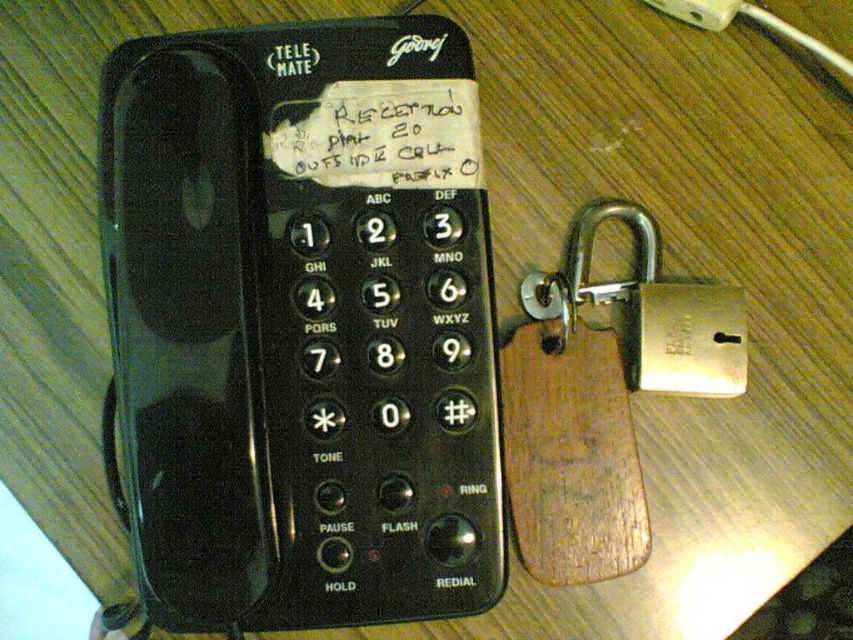
You are organizing items on a desk and need to place the white paper at center and the white plastic plug at upper right. According to the scene, where should you position them relative to each other?

The white paper at center should be placed below the white plastic plug at upper right.